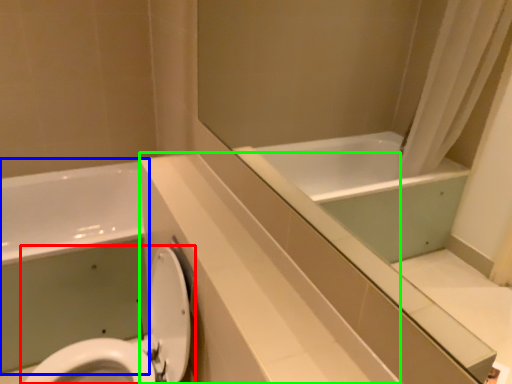
Question: Estimate the real-world distances between objects in this image. Which object is closer to toilet (highlighted by a red box), bath (highlighted by a blue box) or counter top (highlighted by a green box)?

Choices:
 (A) bath
 (B) counter top

Answer: (B)